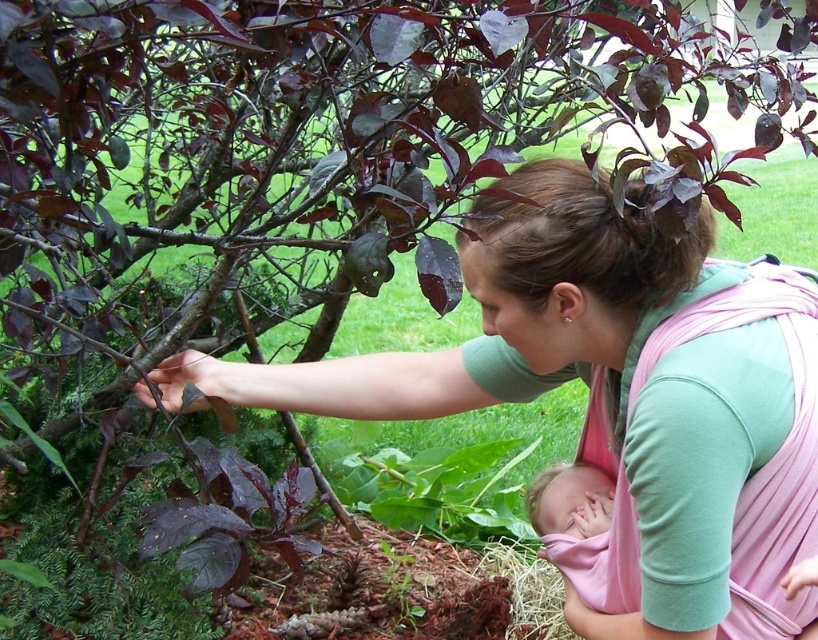
Question: Which of the following is the farthest from the observer?

Choices:
 (A) (661, 627)
 (B) (524, 602)
 (C) (599, 532)

Answer: (B)

Question: Can you confirm if pink fabric baby at center is wider than pink fabric baby at lower right?

Choices:
 (A) no
 (B) yes

Answer: (B)

Question: Does pink fabric carrier at center lie in front of pink fabric baby at lower right?

Choices:
 (A) no
 (B) yes

Answer: (B)

Question: Observing the image, what is the correct spatial positioning of pink fabric baby at center in reference to haystraw-likehay at lower center?

Choices:
 (A) below
 (B) above

Answer: (B)

Question: Which point is farther from the camera taking this photo?

Choices:
 (A) (537, 634)
 (B) (583, 465)

Answer: (A)

Question: Which of these objects is positioned closest to the pink fabric baby at center?

Choices:
 (A) pink fabric baby at lower right
 (B) pink fabric carrier at center
 (C) haystraw-likehay at lower center

Answer: (A)